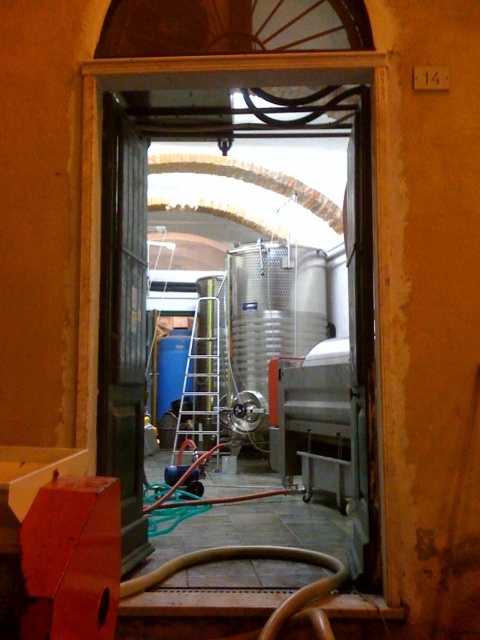
You are standing in front of the arched doorway and need to exit through the black wooden door at left. Based on the coordinates provided in the Objects Description, is the door positioned to your left or right side relative to your current facing direction?

The black wooden door at left is located at point coordinates, so the door is positioned to your left side relative to your current facing direction.

You are standing in front of the black wooden door at left and the silver metallic ladder at center. Which object is positioned to the right when facing the scene?

The black wooden door at left is to the right of the silver metallic ladder at center, so the black wooden door at left is positioned to the right when facing the scene.